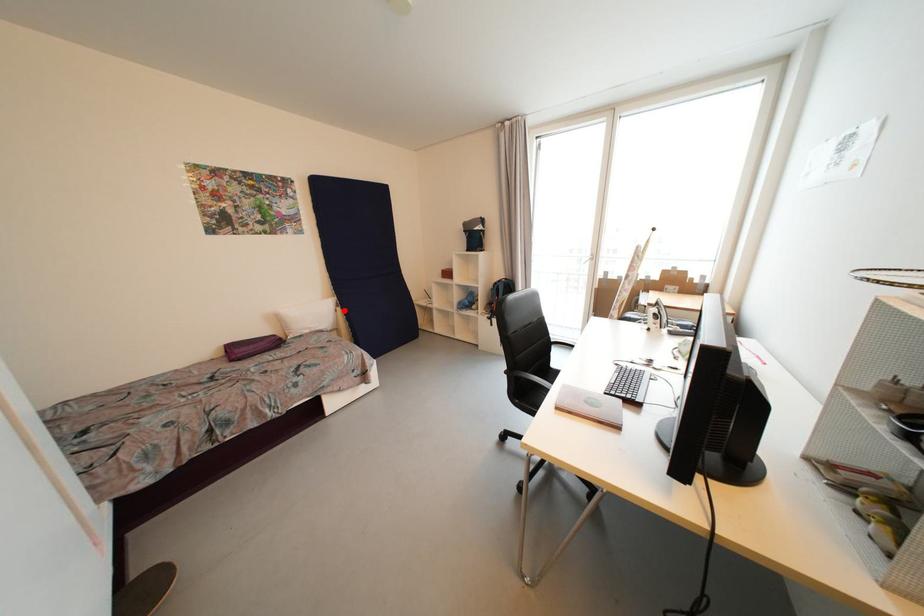
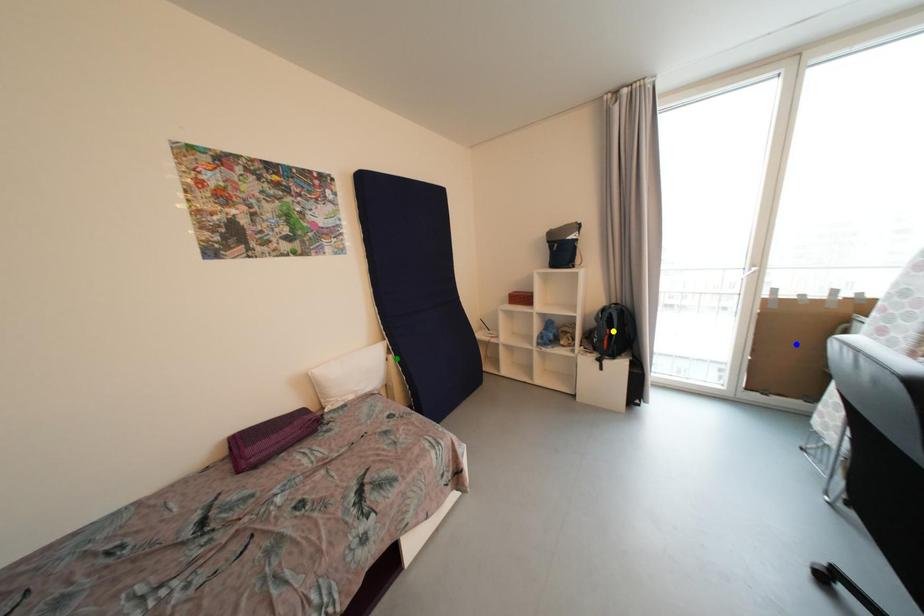
Question: I am providing you with two images of the same scene from different viewpoints. A red point is marked on the first image. You are given multiple points on the second image. Which mark in image 2 goes with the point in image 1?

Choices:
 (A) yellow point
 (B) green point
 (C) blue point

Answer: (B)